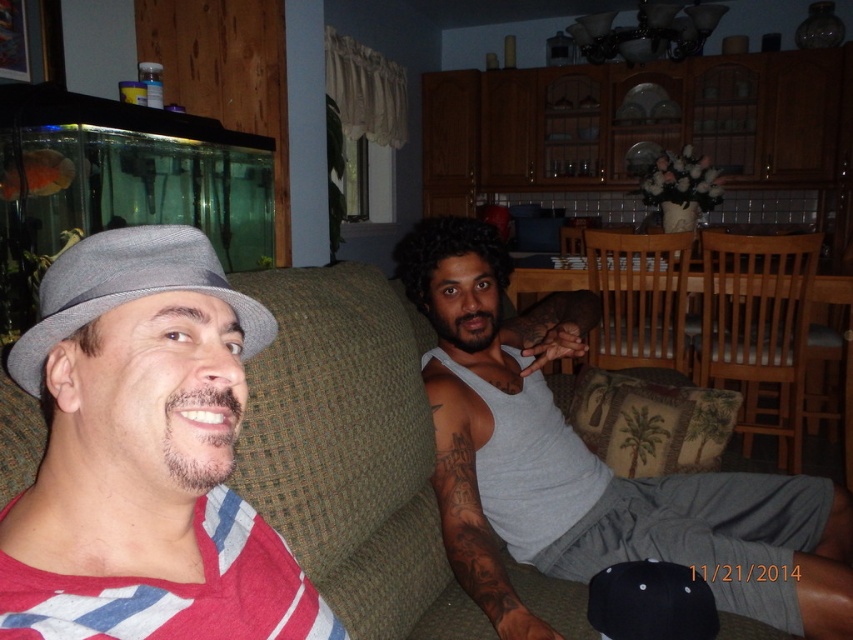
Question: Is gray matte tank top at center positioned behind goldfish at left?

Choices:
 (A) yes
 (B) no

Answer: (B)

Question: Among these objects, which one is farthest from the camera?

Choices:
 (A) gray fabric hat at upper left
 (B) goldfish at left
 (C) gray tank top at center
 (D) black matte baseball cap at lower center

Answer: (B)

Question: Is gray felt fedora at left bigger than gray matte tank top at center?

Choices:
 (A) no
 (B) yes

Answer: (A)

Question: Which point is closer to the camera?

Choices:
 (A) (28, 186)
 (B) (50, 337)

Answer: (B)

Question: Which is nearer to the gray tank top at center?

Choices:
 (A) black matte baseball cap at lower center
 (B) gray matte tank top at center
 (C) gray fabric hat at upper left

Answer: (B)

Question: Does gray felt fedora at left come behind gray matte tank top at center?

Choices:
 (A) no
 (B) yes

Answer: (A)